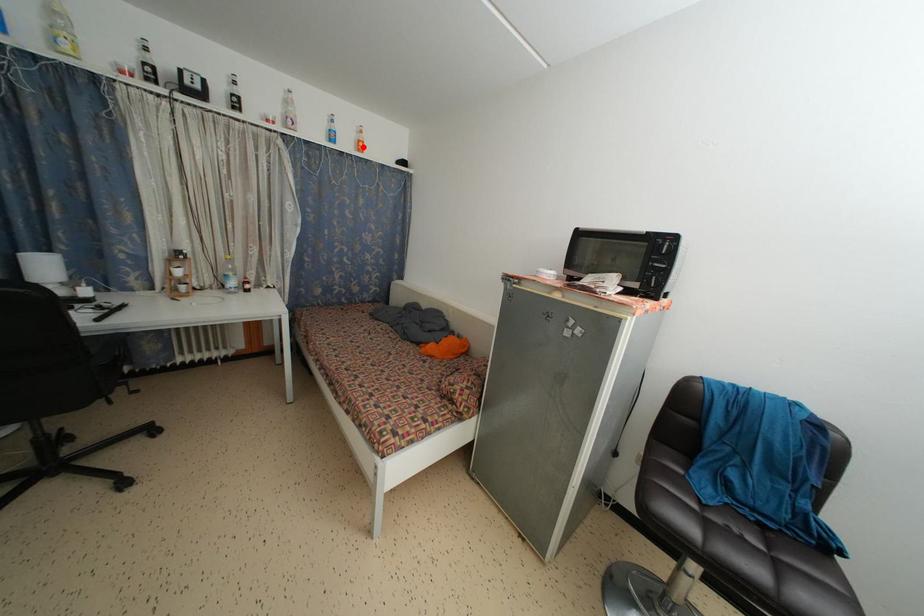
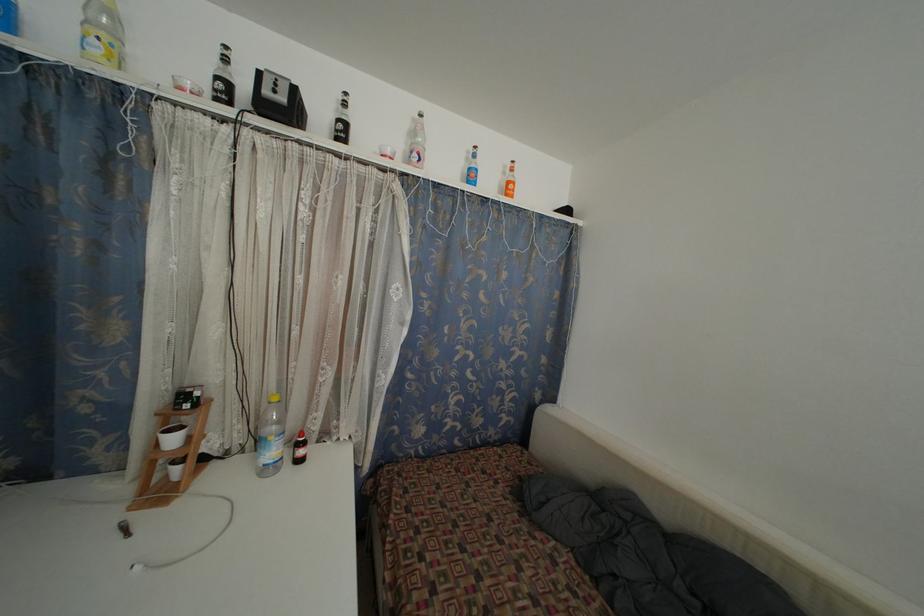
In the second image, find the point that corresponds to the highlighted location in the first image.

(513, 188)